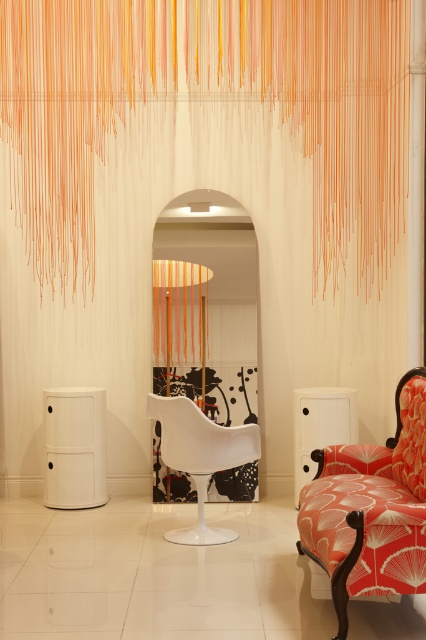
Question: Which of the following is the closest to the observer?

Choices:
 (A) orange string curtain at upper center
 (B) orange floral fabric armchair at right
 (C) white matte armchair at center

Answer: (B)

Question: Which point is closer to the camera taking this photo?

Choices:
 (A) (271, 22)
 (B) (161, 412)

Answer: (B)

Question: From the image, what is the correct spatial relationship of orange floral fabric armchair at right in relation to white matte armchair at center?

Choices:
 (A) left
 (B) right

Answer: (B)

Question: Which object is farther from the camera taking this photo?

Choices:
 (A) white matte armchair at center
 (B) orange string curtain at upper center
 (C) orange floral fabric armchair at right

Answer: (B)

Question: Does orange string curtain at upper center come behind white matte armchair at center?

Choices:
 (A) no
 (B) yes

Answer: (B)

Question: Can you confirm if orange string curtain at upper center is positioned to the right of orange floral fabric armchair at right?

Choices:
 (A) no
 (B) yes

Answer: (A)